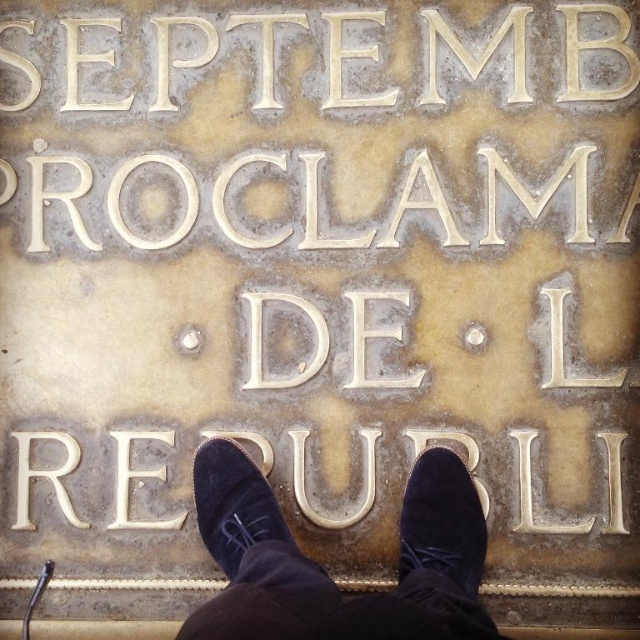
Which is more to the left, velvet-like dark blue shoe at lower center or suede shoe at center?

Positioned to the left is suede shoe at center.

Measure the distance between velvet-like dark blue shoe at lower center and camera.

They are 5.62 feet apart.

The height and width of the screenshot is (640, 640). I want to click on velvet-like dark blue shoe at lower center, so click(x=442, y=522).

In the scene shown: Which of these two, suede shoes at center or velvet-like dark blue shoe at lower center, stands taller?

Standing taller between the two is suede shoes at center.

Which is in front, point (420, 564) or point (413, 484)?

Positioned in front is point (420, 564).

Between point (275, 636) and point (417, 497), which one is positioned behind?

Point (417, 497)

This screenshot has width=640, height=640. In order to click on suede shoes at center in this screenshot , I will do `click(323, 570)`.

Between suede shoes at center and suede shoe at center, which one is positioned lower?

suede shoes at center

Is suede shoes at center thinner than suede shoe at center?

No, suede shoes at center is not thinner than suede shoe at center.

I want to click on suede shoes at center, so click(x=323, y=570).

I want to click on suede shoes at center, so click(x=323, y=570).